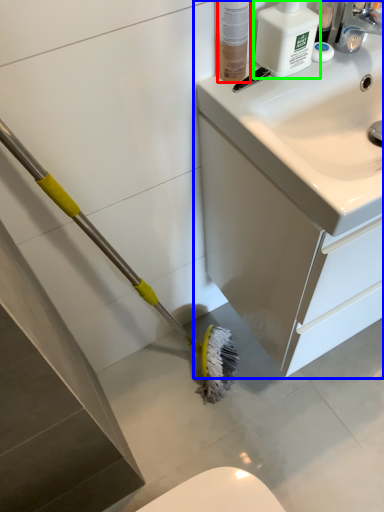
Question: Which object is positioned farthest from toiletry (highlighted by a red box)? Select from bathroom cabinet (highlighted by a blue box) and cleaning product (highlighted by a green box).

Choices:
 (A) bathroom cabinet
 (B) cleaning product

Answer: (A)